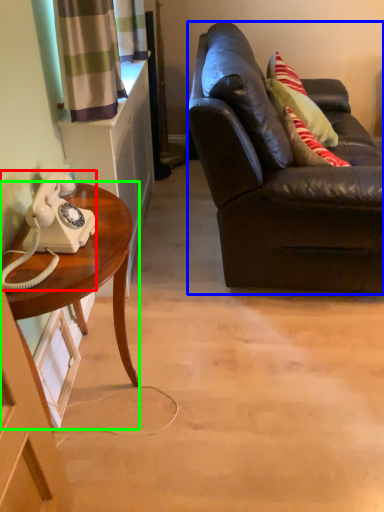
Question: Which object is the farthest from corded phone (highlighted by a red box)? Choose among these: studio couch (highlighted by a blue box) or desk (highlighted by a green box).

Choices:
 (A) studio couch
 (B) desk

Answer: (A)